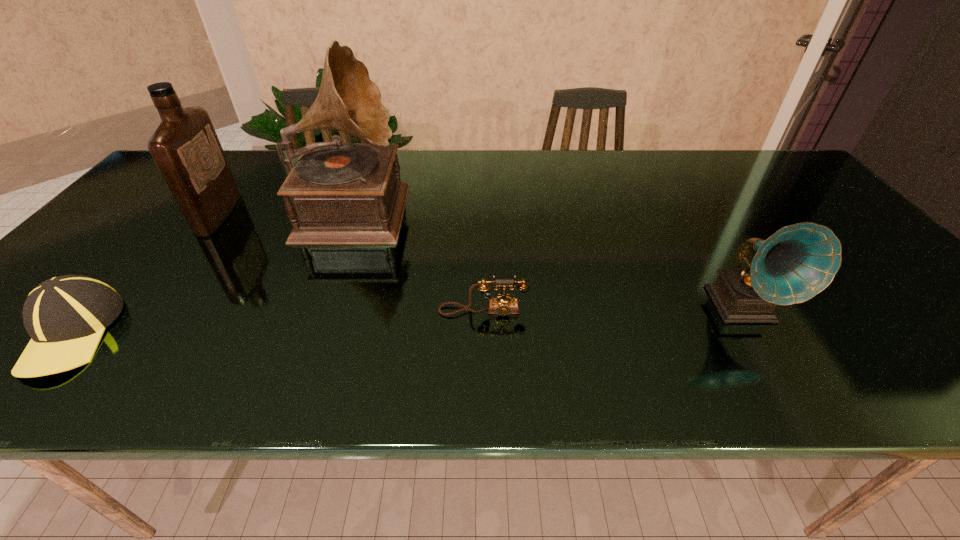
Identify the location of object that is at the far edge. The width and height of the screenshot is (960, 540). (337, 193).

Identify the location of free region at the far edge of the desktop. The height and width of the screenshot is (540, 960). (502, 153).

Where is `free spot at the near edge of the desktop`? free spot at the near edge of the desktop is located at coordinates (369, 356).

The height and width of the screenshot is (540, 960). In order to click on free region at the right edge in this screenshot , I will do `click(938, 347)`.

At what (x,y) coordinates should I click in order to perform the action: click on vacant space at the far left corner of the desktop. Please return your answer as a coordinate pair (x, y). The image size is (960, 540). Looking at the image, I should click on (157, 183).

Locate an element on the screen. unoccupied area between the second tallest object and the third tallest object is located at coordinates (481, 261).

This screenshot has width=960, height=540. What are the coordinates of `vacant area that lies between the phonograph_record and the second object from right to left` in the screenshot? It's located at pos(612,309).

This screenshot has width=960, height=540. In order to click on unoccupied position between the third object from left to right and the phonograph_record in this screenshot , I will do `click(548, 257)`.

Locate an element on the screen. free space between the tallest object and the rightmost object is located at coordinates (548, 257).

You are a GUI agent. You are given a task and a screenshot of the screen. Output one action in this format:
    pyautogui.click(x=<x>, y=<y>)
    Task: Click on the blank region between the second tallest object and the phonograph_record
    Image resolution: width=960 pixels, height=540 pixels.
    Given the screenshot: What is the action you would take?
    pyautogui.click(x=481, y=261)